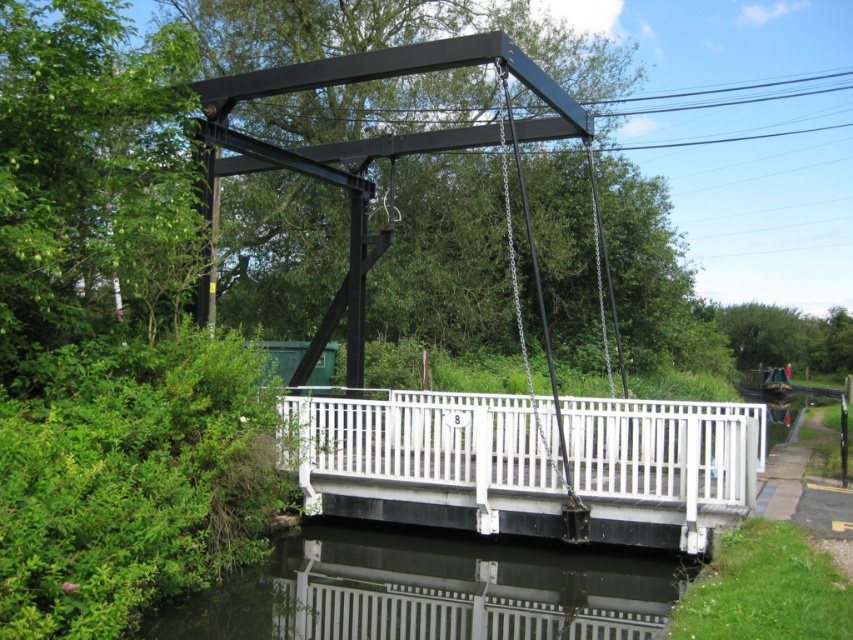
Question: Observing the image, what is the correct spatial positioning of white painted wood bridge at center in reference to transparent glass water at lower center?

Choices:
 (A) below
 (B) above

Answer: (B)

Question: Can you confirm if white painted wood bridge at center is smaller than transparent glass water at lower center?

Choices:
 (A) no
 (B) yes

Answer: (A)

Question: Which of the following is the farthest from the observer?

Choices:
 (A) transparent glass water at lower center
 (B) white painted wood bridge at center

Answer: (B)

Question: Which of the following is the farthest from the observer?

Choices:
 (A) (440, 552)
 (B) (354, 433)

Answer: (B)

Question: Is white painted wood bridge at center behind transparent glass water at lower center?

Choices:
 (A) no
 (B) yes

Answer: (B)